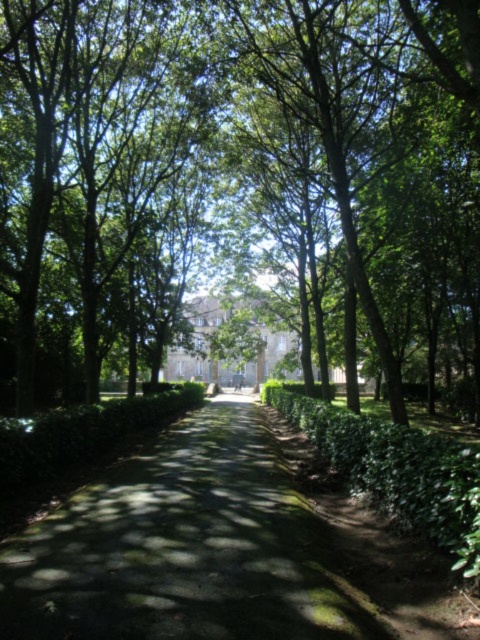
Question: Where is green leafy tree at center located in relation to green mossy path at center in the image?

Choices:
 (A) above
 (B) below

Answer: (A)

Question: Does green leafy tree at center come in front of green leafy hedge at center?

Choices:
 (A) no
 (B) yes

Answer: (A)

Question: Which of the following is the closest to the observer?

Choices:
 (A) green mossy path at center
 (B) green leafy hedge at center

Answer: (A)

Question: Which object is the farthest from the green leafy tree at center?

Choices:
 (A) green mossy path at center
 (B) green leafy hedge at center

Answer: (A)

Question: Which of the following is the closest to the observer?

Choices:
 (A) (437, 529)
 (B) (400, 36)

Answer: (A)

Question: Can you confirm if green mossy path at center is positioned to the right of green leafy hedge at center?

Choices:
 (A) no
 (B) yes

Answer: (A)